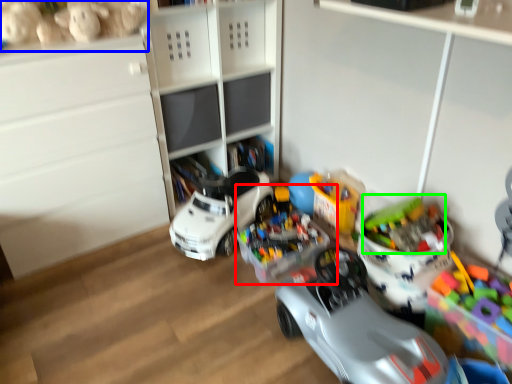
Question: Based on their relative distances, which object is farther from toy (highlighted by a red box)? Choose from toy (highlighted by a blue box) and toy (highlighted by a green box).

Choices:
 (A) toy
 (B) toy

Answer: (A)